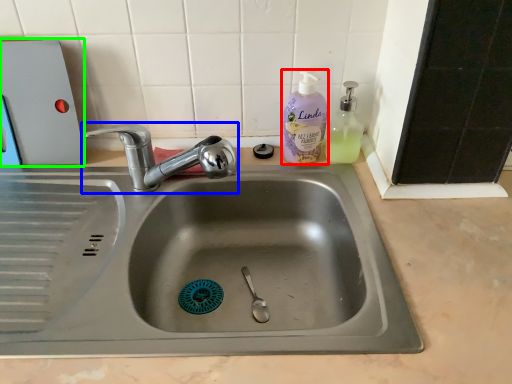
Question: Which is farther away from cleaning product (highlighted by a red box)? tap (highlighted by a blue box) or appliance (highlighted by a green box)?

Choices:
 (A) tap
 (B) appliance

Answer: (B)